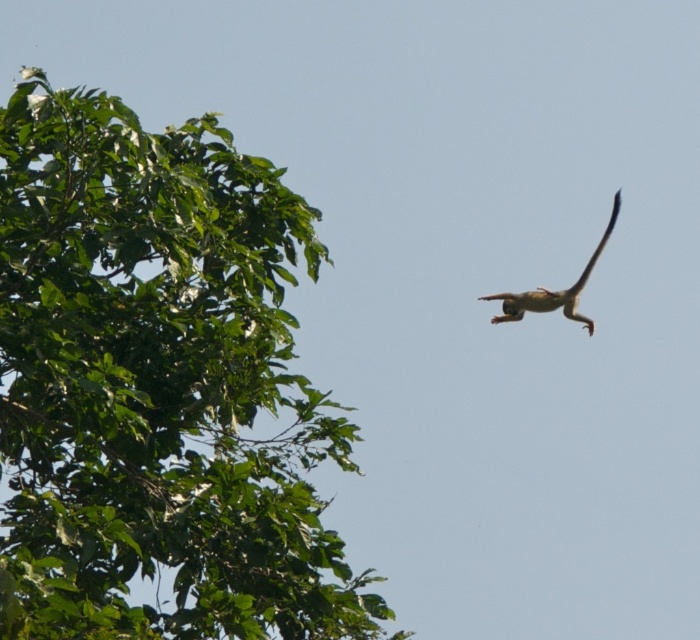
Question: Can you confirm if green leafy tree at upper left is smaller than brown furry monkey at upper right?

Choices:
 (A) no
 (B) yes

Answer: (A)

Question: Which point appears farthest from the camera in this image?

Choices:
 (A) (308, 468)
 (B) (532, 298)

Answer: (B)

Question: Is the position of green leafy tree at upper left more distant than that of brown furry monkey at upper right?

Choices:
 (A) no
 (B) yes

Answer: (A)

Question: Is green leafy tree at upper left thinner than brown furry monkey at upper right?

Choices:
 (A) no
 (B) yes

Answer: (A)

Question: Which of the following is the farthest from the observer?

Choices:
 (A) (183, 296)
 (B) (561, 301)

Answer: (B)